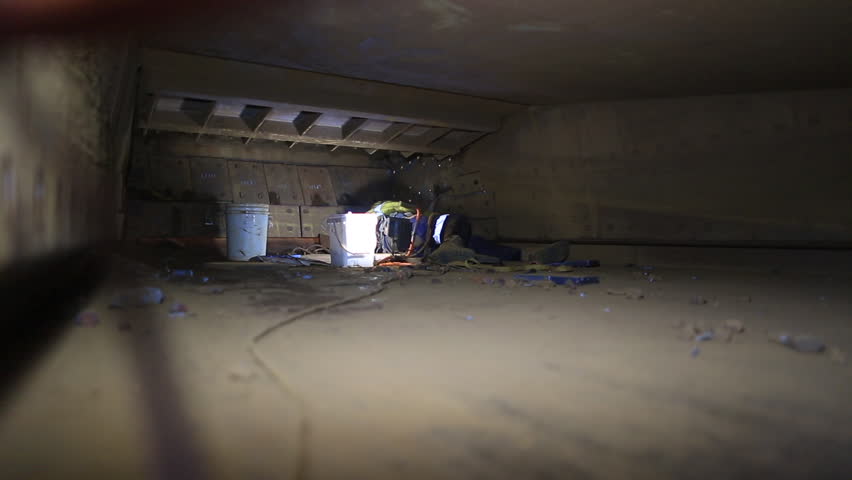
Where is `light reflection on wall`? The image size is (852, 480). light reflection on wall is located at coordinates [x=37, y=201], [x=66, y=86], [x=85, y=113], [x=25, y=139].